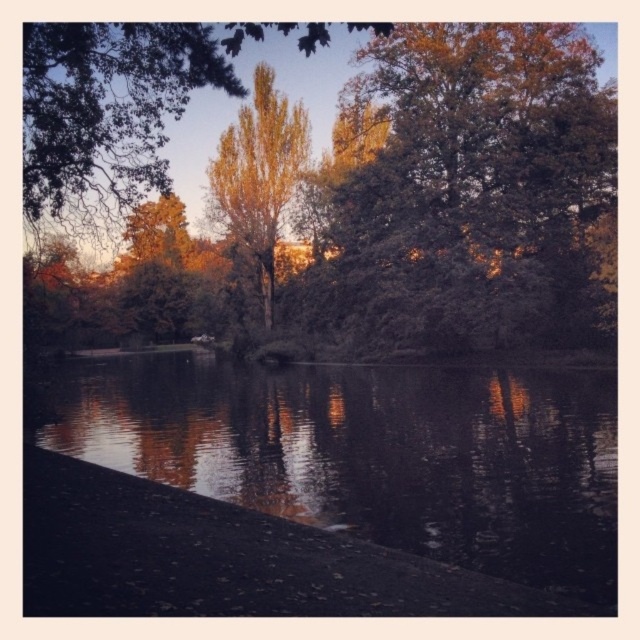
Question: Among these objects, which one is nearest to the camera?

Choices:
 (A) smooth dark water at bottom center
 (B) green leafy tree at upper center

Answer: (A)

Question: Estimate the real-world distances between objects in this image. Which object is closer to the green leafy tree at upper center?

Choices:
 (A) golden textured tree at center
 (B) golden leafy tree at upper center
 (C) smooth dark water at bottom center

Answer: (C)

Question: Does smooth dark water at bottom center have a smaller size compared to green leafy tree at upper center?

Choices:
 (A) no
 (B) yes

Answer: (B)

Question: Which object appears farthest from the camera in this image?

Choices:
 (A) golden textured tree at center
 (B) smooth dark water at bottom center

Answer: (A)

Question: Can you confirm if smooth dark water at bottom center is wider than green leafy tree at upper center?

Choices:
 (A) no
 (B) yes

Answer: (B)

Question: Can you confirm if golden leafy tree at upper center is wider than golden textured tree at center?

Choices:
 (A) no
 (B) yes

Answer: (B)